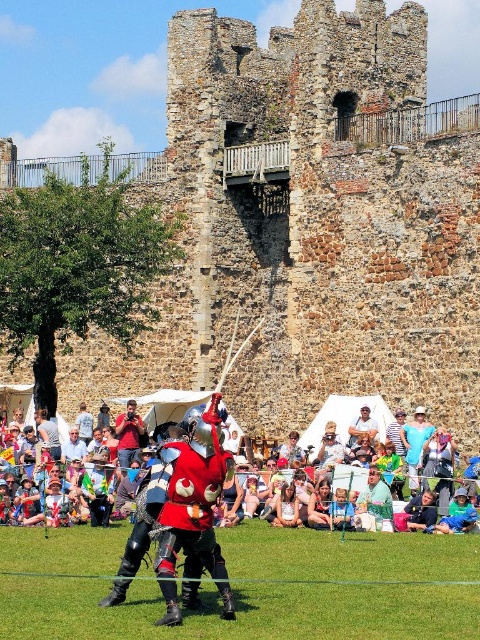
Does brown stone castle at upper center appear under matte red armor at center?

Actually, brown stone castle at upper center is above matte red armor at center.

In the scene shown: Who is shorter, brown stone castle at upper center or matte red armor at center?

matte red armor at center is shorter.

At what (x,y) coordinates should I click in order to perform the action: click on brown stone castle at upper center. Please return your answer as a coordinate pair (x, y). Image resolution: width=480 pixels, height=640 pixels. Looking at the image, I should click on (311, 224).